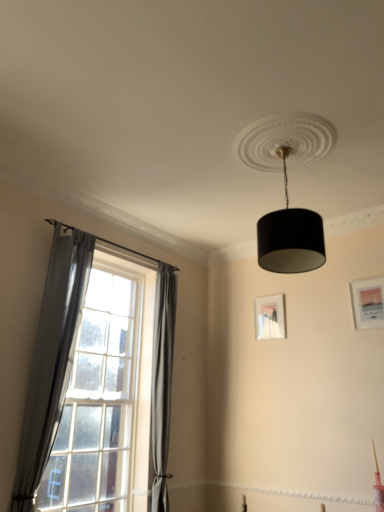
Question: Looking at their shapes, would you say gray fabric curtain at left, the 2th curtain positioned from the front, is wider or thinner than clear glass window at left?

Choices:
 (A) wide
 (B) thin

Answer: (A)

Question: Would you say gray fabric curtain at left, placed as the 1th curtain when sorted from right to left, is to the left or to the right of clear glass window at left in the picture?

Choices:
 (A) left
 (B) right

Answer: (B)

Question: Based on their relative distances, which object is farther from the matte white picture frame at center, the first picture frame from the left?

Choices:
 (A) matte white picture frame at upper right, acting as the 1th picture frame starting from the front
 (B) clear glass window at left
 (C) gray fabric curtain at left, which ranks as the second curtain in left-to-right order
 (D) gray fabric curtain at left, arranged as the 1th curtain when viewed from the left
 (E) black textured lampshade at upper center

Answer: (D)

Question: Based on their relative distances, which object is farther from the matte white picture frame at upper right, arranged as the second picture frame when viewed from the left?

Choices:
 (A) gray fabric curtain at left, which is the second curtain from back to front
 (B) black textured lampshade at upper center
 (C) clear glass window at left
 (D) matte white picture frame at center, positioned as the second picture frame in right-to-left order
 (E) gray fabric curtain at left, placed as the 1th curtain when sorted from right to left

Answer: (A)